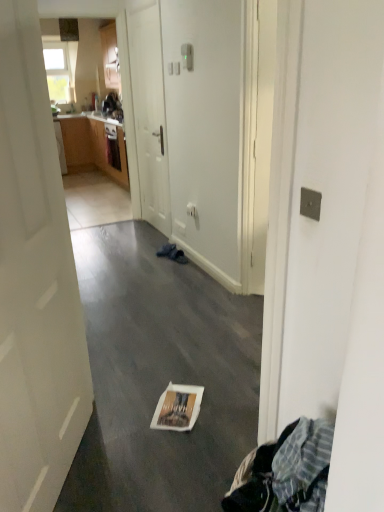
What is the approximate width of white matte door at center, the first door viewed from the back?

white matte door at center, the first door viewed from the back, is 2.83 inches wide.

The image size is (384, 512). I want to click on white glossy door at left, arranged as the 1th door when viewed from the front, so click(35, 284).

Where is `white matte door at center, which is the second door from front to back`? This screenshot has height=512, width=384. white matte door at center, which is the second door from front to back is located at coordinates (149, 115).

Which of these two, white matte door at center, the first door viewed from the back, or white paper bag at center, is smaller?

white paper bag at center.

Considering the sizes of white matte door at center, which is the second door from front to back, and white paper bag at center in the image, is white matte door at center, which is the second door from front to back, taller or shorter than white paper bag at center?

white matte door at center, which is the second door from front to back, is taller than white paper bag at center.

From the image's perspective, is white matte door at center, the first door viewed from the back, beneath white paper bag at center?

Actually, white matte door at center, the first door viewed from the back, appears above white paper bag at center in the image.

Can you tell me how much white matte door at center, which is the second door from front to back, and white paper bag at center differ in facing direction?

The facing directions of white matte door at center, which is the second door from front to back, and white paper bag at center are 89.1 degrees apart.

You are a GUI agent. You are given a task and a screenshot of the screen. Output one action in this format:
    pyautogui.click(x=<x>, y=<y>)
    Task: Click on the door that is on the right side of white glossy door at left, arranged as the 1th door when viewed from the front
    
    Given the screenshot: What is the action you would take?
    pyautogui.click(x=149, y=115)

Is white glossy door at left, arranged as the 1th door when viewed from the front, at the back of white matte door at center, the first door viewed from the back?

No, white matte door at center, the first door viewed from the back,'s orientation is not away from white glossy door at left, arranged as the 1th door when viewed from the front.

Is white matte door at center, the first door viewed from the back, thinner than white glossy door at left, arranged as the 1th door when viewed from the front?

Incorrect, the width of white matte door at center, the first door viewed from the back, is not less than that of white glossy door at left, arranged as the 1th door when viewed from the front.

Can you confirm if white matte door at center, which is the second door from front to back, is shorter than white glossy door at left, arranged as the 1th door when viewed from the front?

In fact, white matte door at center, which is the second door from front to back, may be taller than white glossy door at left, arranged as the 1th door when viewed from the front.

From a real-world perspective, is white glossy door at left, the 2th door viewed from the back, positioned above or below white glossy magazine at center?

white glossy door at left, the 2th door viewed from the back, is above white glossy magazine at center.

Is white glossy door at left, the 2th door viewed from the back, thinner than white glossy magazine at center?

Yes.

Are white matte door at center, the first door viewed from the back, and white glossy magazine at center located far from each other?

Yes, white matte door at center, the first door viewed from the back, and white glossy magazine at center are located far from each other.

From a real-world perspective, who is located higher, white matte door at center, the first door viewed from the back, or white glossy magazine at center?

From a 3D spatial view, white matte door at center, the first door viewed from the back, is above.

Is white glossy magazine at center located within white matte door at center, the first door viewed from the back?

No, white glossy magazine at center is not a part of white matte door at center, the first door viewed from the back.

Could you measure the distance between white matte door at center, which is the second door from front to back, and white glossy magazine at center?

white matte door at center, which is the second door from front to back, and white glossy magazine at center are 2.63 meters apart from each other.

Could you tell me if white glossy magazine at center is facing white paper bag at center?

No, white glossy magazine at center is not aimed at white paper bag at center.

Between white glossy magazine at center and white paper bag at center, which one has larger size?

white paper bag at center is bigger.

Is white glossy magazine at center at the right side of white paper bag at center?

Yes, white glossy magazine at center is to the right of white paper bag at center.

Which object is more forward, white glossy magazine at center or white paper bag at center?

white paper bag at center.

Where is `concrete below the white glossy door at left, arranged as the 1th door when viewed from the front (from the image's perspective)`? Image resolution: width=384 pixels, height=512 pixels. concrete below the white glossy door at left, arranged as the 1th door when viewed from the front (from the image's perspective) is located at coordinates (160, 376).

Can you confirm if white glossy door at left, arranged as the 1th door when viewed from the front, is smaller than white paper bag at center?

Yes.

Is white glossy door at left, the 2th door viewed from the back, inside or outside of white paper bag at center?

white glossy door at left, the 2th door viewed from the back, is outside white paper bag at center.

From the image's perspective, is white glossy door at left, arranged as the 1th door when viewed from the front, located above or below white paper bag at center?

white glossy door at left, arranged as the 1th door when viewed from the front, is situated higher than white paper bag at center in the image.

In terms of height, does white glossy magazine at center look taller or shorter compared to white glossy door at left, arranged as the 1th door when viewed from the front?

In the image, white glossy magazine at center appears to be shorter than white glossy door at left, arranged as the 1th door when viewed from the front.

Between white glossy magazine at center and white glossy door at left, the 2th door viewed from the back, which one has smaller size?

Smaller between the two is white glossy magazine at center.

From a real-world perspective, is white glossy magazine at center positioned over white glossy door at left, arranged as the 1th door when viewed from the front, based on gravity?

No.

This screenshot has height=512, width=384. What are the coordinates of `the 1st door to the left of the white paper bag at center, counting from the anchor's position` in the screenshot? It's located at (149, 115).

Where is `door above the white glossy door at left, the 2th door viewed from the back (from the image's perspective)`? This screenshot has height=512, width=384. door above the white glossy door at left, the 2th door viewed from the back (from the image's perspective) is located at coordinates (149, 115).

Considering their positions, is white glossy door at left, the 2th door viewed from the back, positioned closer to white paper bag at center than white matte door at center, the first door viewed from the back?

Based on the image, white glossy door at left, the 2th door viewed from the back, appears to be nearer to white paper bag at center.

Estimate the real-world distances between objects in this image. Which object is closer to white matte door at center, which is the second door from front to back, white glossy magazine at center or white glossy door at left, the 2th door viewed from the back?

The object closer to white matte door at center, which is the second door from front to back, is white glossy door at left, the 2th door viewed from the back.

Which object lies further to the anchor point white glossy magazine at center, white paper bag at center or white matte door at center, which is the second door from front to back?

white matte door at center, which is the second door from front to back, is positioned further to the anchor white glossy magazine at center.

Considering their positions, is white glossy magazine at center positioned closer to white glossy door at left, the 2th door viewed from the back, than white matte door at center, which is the second door from front to back?

Among the two, white glossy magazine at center is located nearer to white glossy door at left, the 2th door viewed from the back.

When comparing their distances from white matte door at center, the first door viewed from the back, does white glossy door at left, the 2th door viewed from the back, or white paper bag at center seem closer?

white paper bag at center is closer to white matte door at center, the first door viewed from the back.

Looking at the image, which one is located further to white glossy door at left, the 2th door viewed from the back, white glossy magazine at center or white paper bag at center?

white glossy magazine at center is positioned further to the anchor white glossy door at left, the 2th door viewed from the back.

Which object lies further to the anchor point white matte door at center, which is the second door from front to back, white paper bag at center or white glossy magazine at center?

The object further to white matte door at center, which is the second door from front to back, is white glossy magazine at center.

Considering their positions, is white matte door at center, the first door viewed from the back, positioned further to white paper bag at center than white glossy magazine at center?

white matte door at center, the first door viewed from the back.

Identify the location of concrete between white matte door at center, which is the second door from front to back, and white glossy magazine at center from top to bottom. (160, 376).

At what (x,y) coordinates should I click in order to perform the action: click on magazine between white glossy door at left, the 2th door viewed from the back, and white matte door at center, which is the second door from front to back, in the front-back direction. Please return your answer as a coordinate pair (x, y). This screenshot has height=512, width=384. Looking at the image, I should click on (178, 408).

The height and width of the screenshot is (512, 384). In order to click on concrete between white glossy door at left, arranged as the 1th door when viewed from the front, and white glossy magazine at center in the front-back direction in this screenshot , I will do `click(160, 376)`.

Image resolution: width=384 pixels, height=512 pixels. What are the coordinates of `concrete between white glossy door at left, arranged as the 1th door when viewed from the front, and white matte door at center, which is the second door from front to back, along the z-axis` in the screenshot? It's located at (160, 376).